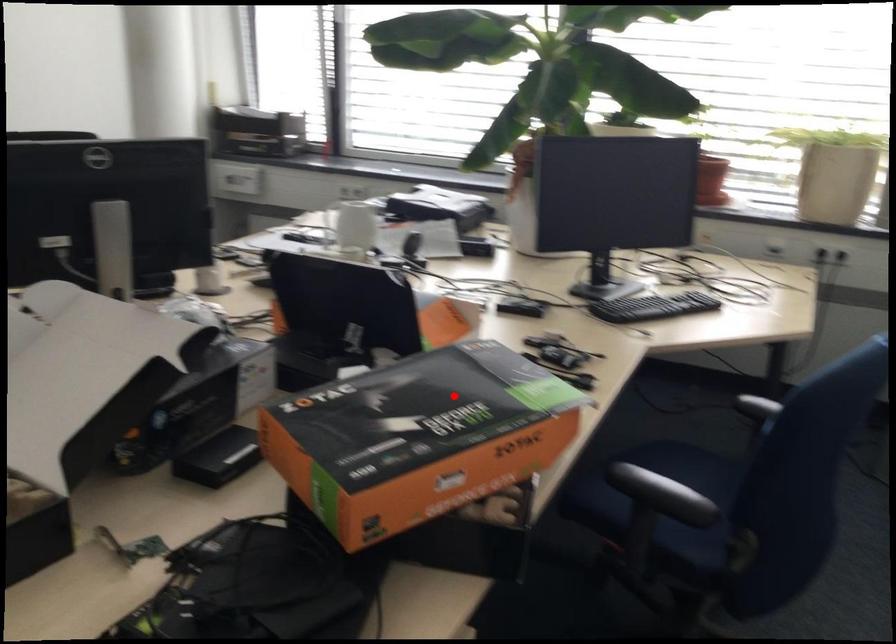
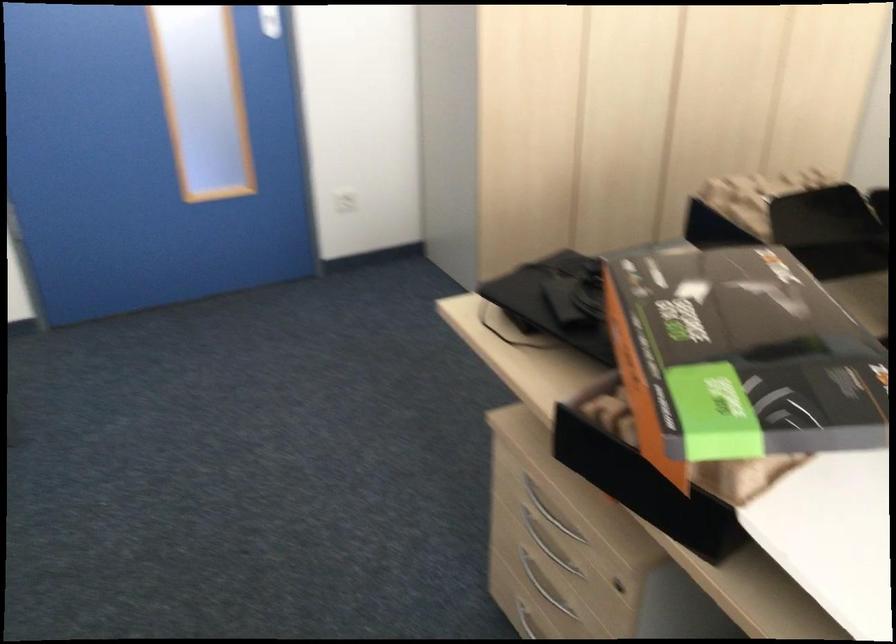
Locate, in the second image, the point that corresponds to the highlighted location in the first image.

(738, 357)